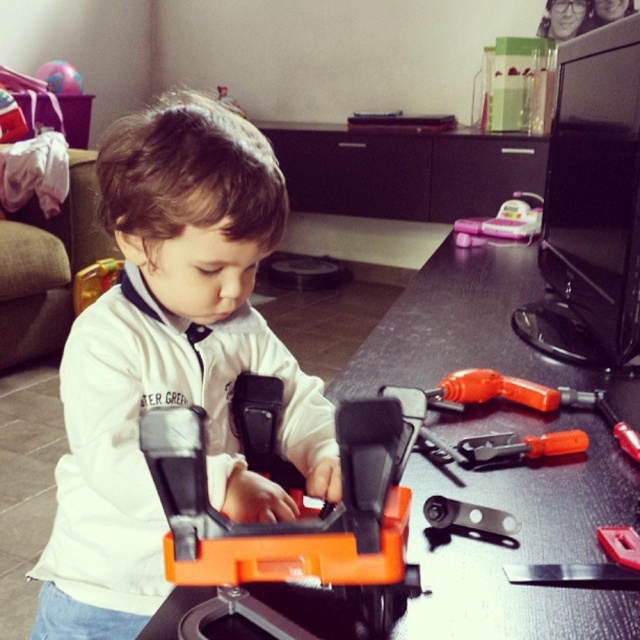
You are a child trying to reach two points in the room. The first point is at coordinate point(490, 316) and the second is at point(636, 541). Which point is closer to you?

Point(636, 541) is closer to you because it is in front of point(490, 316).

Looking at this image, you are a robot observing the child playing with the toy tools. You need to locate two points in the image to assist the child. The first point is at coordinates point (298, 531) and the second point is at point (540, 216). Which point is closer to the child?

Point (298, 531) is in front of point (540, 216), so it is closer to the child.

You are a parent trying to locate your child who is playing with a toy tool set at a dark wooden table. The parent is standing at point A, which is at coordinates 0.0, 0.0. The child is at the center of the table. The orange plastic tool at center is at point 0.816, 0.453. Which direction should the parent move to reach the child and the tool?

The parent should move towards the orange plastic tool at center located at point (289, 522) to reach the child and the tool.